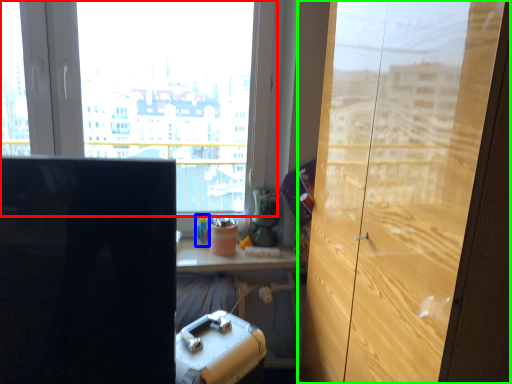
Question: Which object is the closest to the window (highlighted by a red box)? Choose among these: stationery (highlighted by a blue box) or cupboard (highlighted by a green box).

Choices:
 (A) stationery
 (B) cupboard

Answer: (A)